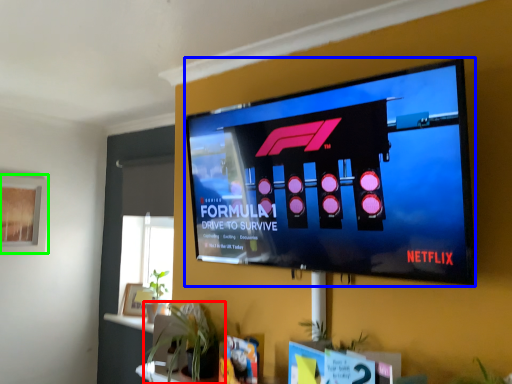
Question: Estimate the real-world distances between objects in this image. Which object is farther from houseplant (highlighted by a red box), television (highlighted by a blue box) or window screen (highlighted by a green box)?

Choices:
 (A) television
 (B) window screen

Answer: (B)